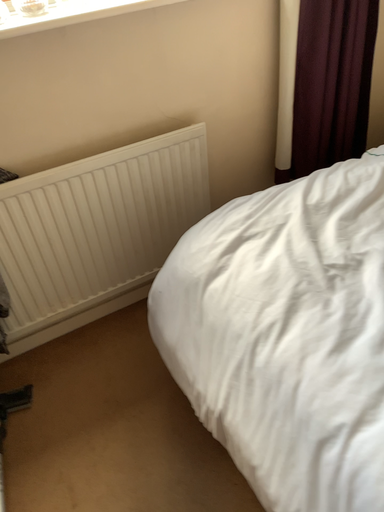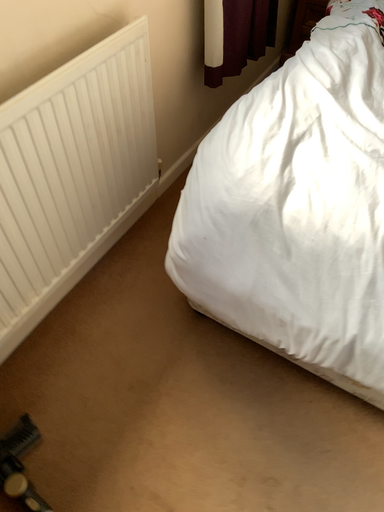
Question: Which way did the camera rotate in the video?

Choices:
 (A) rotated right
 (B) rotated left

Answer: (A)